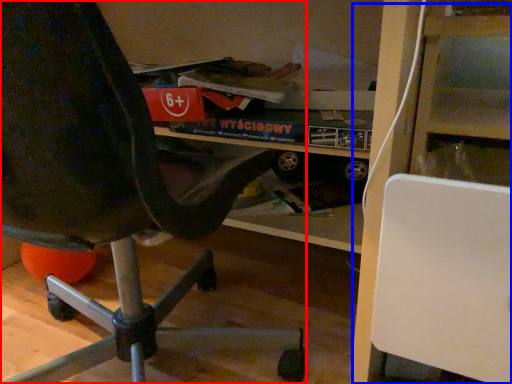
Question: Which object is further to the camera taking this photo, chair (highlighted by a red box) or shelf (highlighted by a blue box)?

Choices:
 (A) chair
 (B) shelf

Answer: (B)